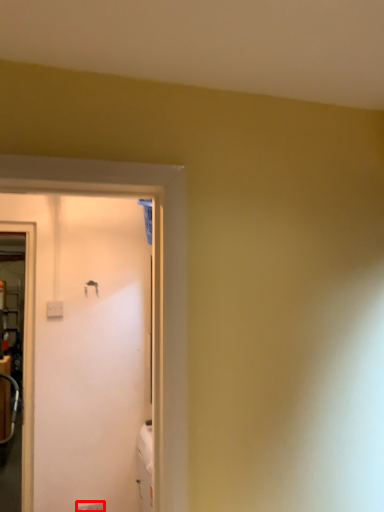
Question: In this image, where is electric outlet (annotated by the red box) located relative to door handle?

Choices:
 (A) left
 (B) right

Answer: (B)